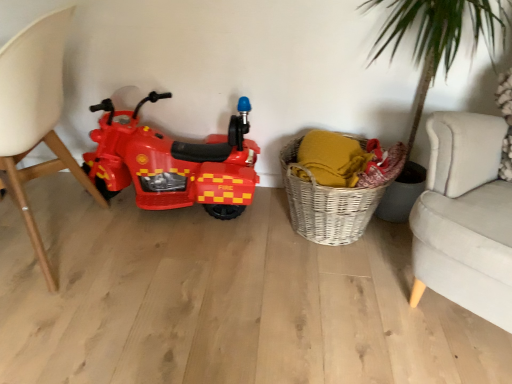
Where is `vacant space in front of woven wicker basket at lower right`? The height and width of the screenshot is (384, 512). vacant space in front of woven wicker basket at lower right is located at coordinates tap(342, 299).